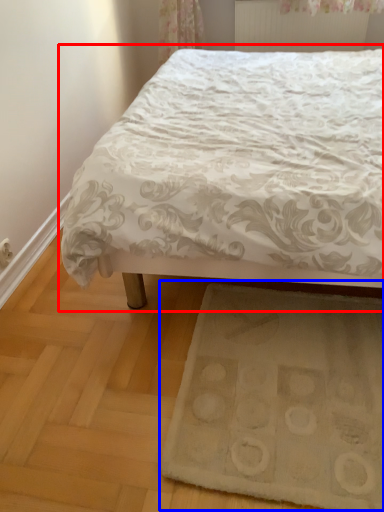
Question: Which point is further to the camera, bed (highlighted by a red box) or doormat (highlighted by a blue box)?

Choices:
 (A) bed
 (B) doormat

Answer: (B)